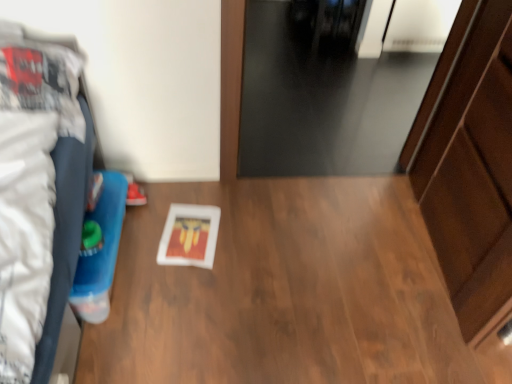
The width and height of the screenshot is (512, 384). In order to click on vacant space in wooden dresser at right (from a real-world perspective) in this screenshot , I will do `click(422, 221)`.